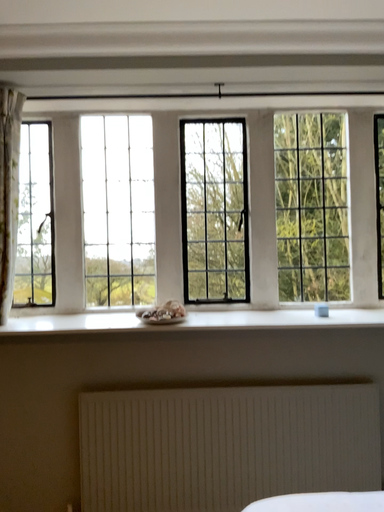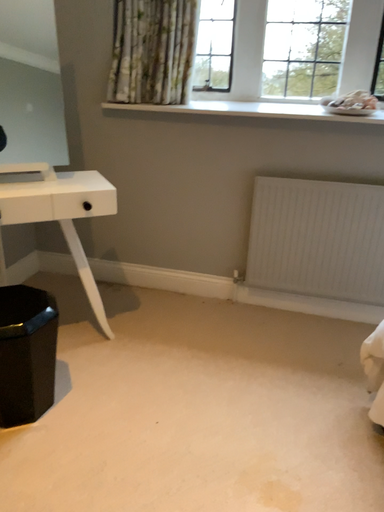
Question: How did the camera likely rotate when shooting the video?

Choices:
 (A) rotated right
 (B) rotated left

Answer: (B)